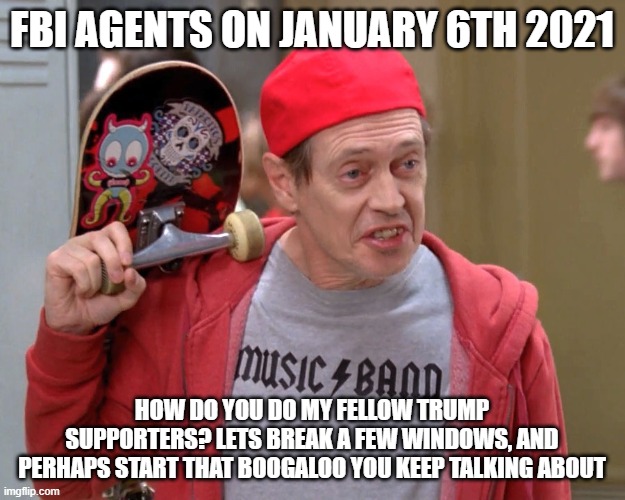
Identify the location of wall. pos(544,193).